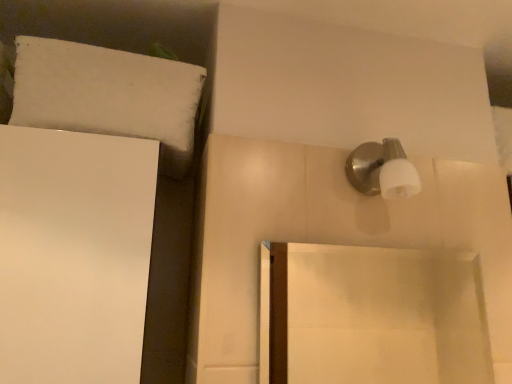
The height and width of the screenshot is (384, 512). Find the location of `smooth white mirror at center`. smooth white mirror at center is located at coordinates (371, 316).

Describe the element at coordinates (371, 316) in the screenshot. I see `smooth white mirror at center` at that location.

You are a GUI agent. You are given a task and a screenshot of the screen. Output one action in this format:
    pyautogui.click(x=<x>, y=<y>)
    Task: Click on the smooth white mirror at center
    
    Given the screenshot: What is the action you would take?
    tap(371, 316)